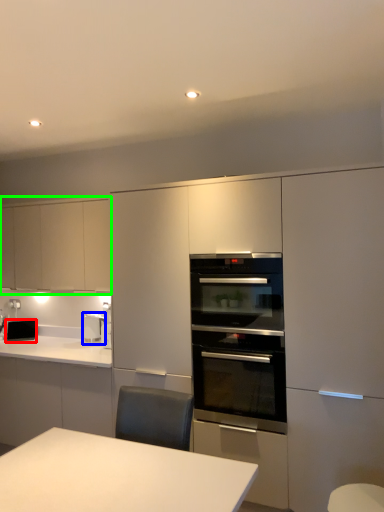
Question: Which object is positioned closest to appliance (highlighted by a red box)? Select from home appliance (highlighted by a blue box) and cabinetry (highlighted by a green box).

Choices:
 (A) home appliance
 (B) cabinetry

Answer: (A)